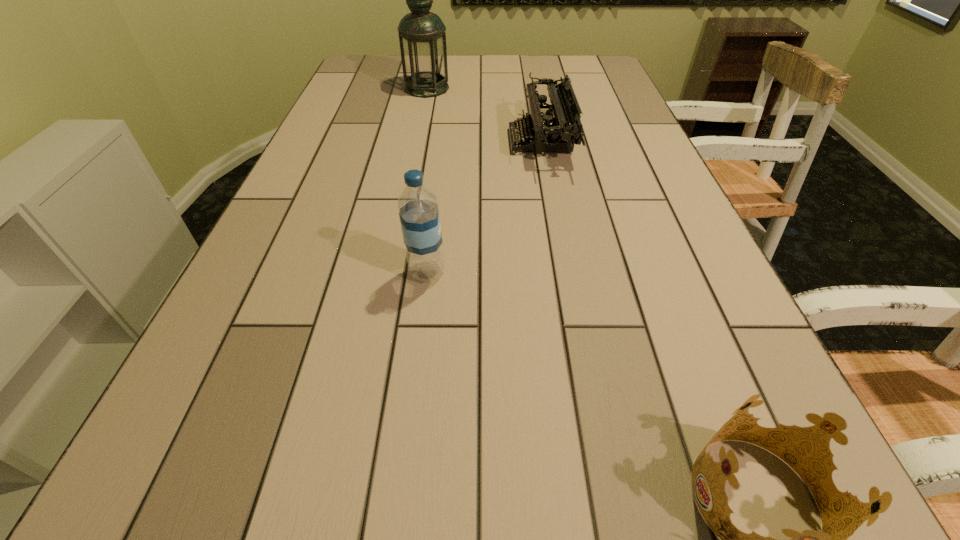
What are the coordinates of `free space located 0.150m on the typing side of the typewriter` in the screenshot? It's located at (454, 141).

Locate an element on the screen. This screenshot has width=960, height=540. object situated at the far edge is located at coordinates (422, 37).

In the image, there is a desktop. Find the location of `vacant space at the far edge`. vacant space at the far edge is located at coordinates (486, 75).

Locate an element on the screen. This screenshot has height=540, width=960. free location at the left edge of the desktop is located at coordinates (365, 107).

This screenshot has height=540, width=960. I want to click on vacant space at the right edge of the desktop, so click(x=697, y=325).

At what (x,y) coordinates should I click in order to perform the action: click on vacant region at the far right corner. Please return your answer as a coordinate pair (x, y). Looking at the image, I should click on coord(577,65).

Image resolution: width=960 pixels, height=540 pixels. In order to click on vacant space that's between the farthest object and the water bottle in this screenshot , I will do `click(427, 180)`.

Find the location of `empty space between the water bottle and the third nearest object`. empty space between the water bottle and the third nearest object is located at coordinates (484, 207).

Where is `unoccupied area between the second tallest object and the farthest object`? unoccupied area between the second tallest object and the farthest object is located at coordinates (427, 180).

The width and height of the screenshot is (960, 540). In order to click on blank region between the farthest object and the third nearest object in this screenshot , I will do `click(484, 114)`.